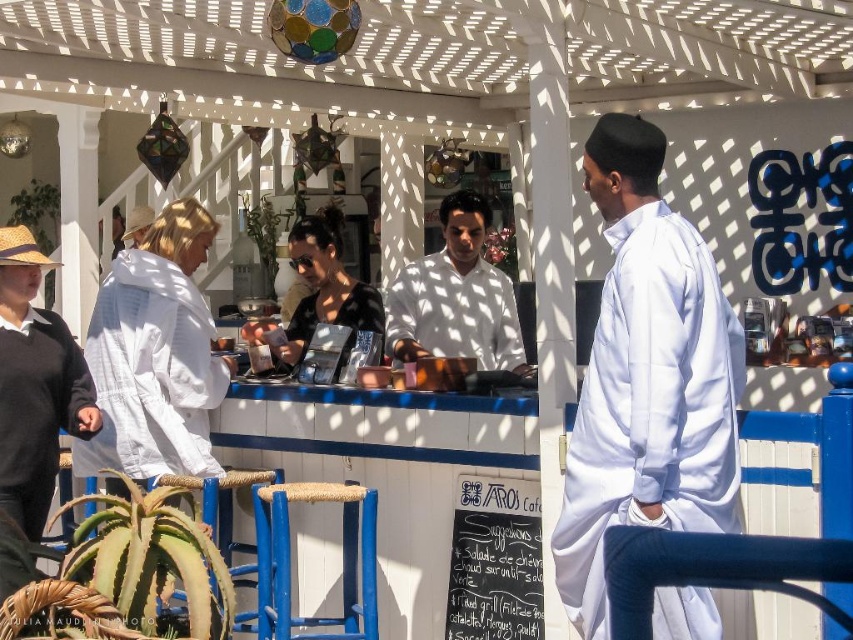
Question: Is dark brown sweater at left positioned at the back of white glossy shirt at center?

Choices:
 (A) yes
 (B) no

Answer: (B)

Question: Is white cotton shirt at center thinner than blue wood stool at center?

Choices:
 (A) yes
 (B) no

Answer: (B)

Question: Among these points, which one is nearest to the camera?

Choices:
 (A) (15, 512)
 (B) (459, 598)

Answer: (A)

Question: Which point appears farthest from the camera in this image?

Choices:
 (A) coord(650,513)
 (B) coord(241,506)
 (C) coord(55,404)
 (D) coord(511,310)

Answer: (D)

Question: Can you confirm if blue wood stool at center is positioned to the right of rope-wrapped stool at lower left?

Choices:
 (A) yes
 (B) no

Answer: (A)

Question: Which point is closer to the camera taking this photo?

Choices:
 (A) 33,413
 (B) 482,209
 (C) 338,621

Answer: (A)